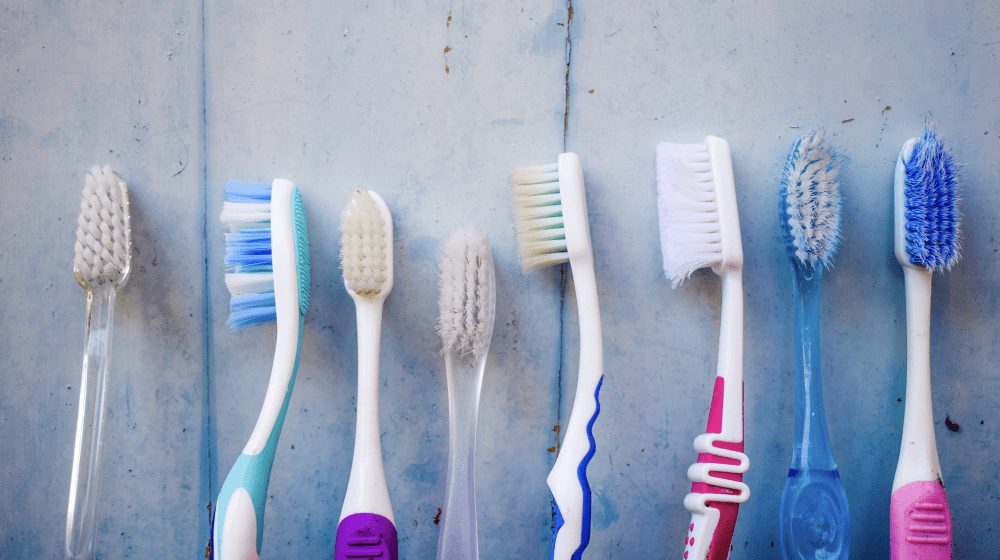
This screenshot has height=560, width=1000. Identify the location of blue translucent brush handle. (820, 520).